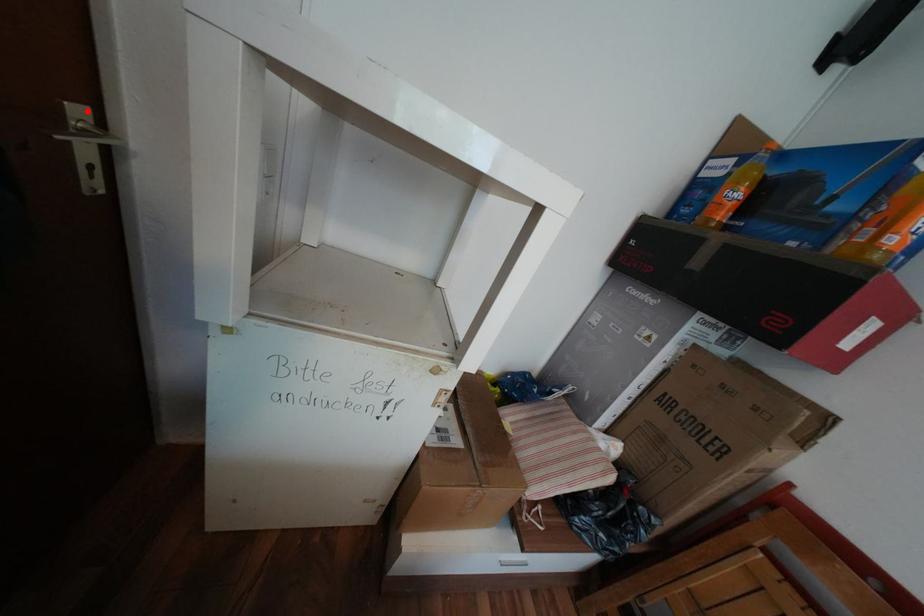
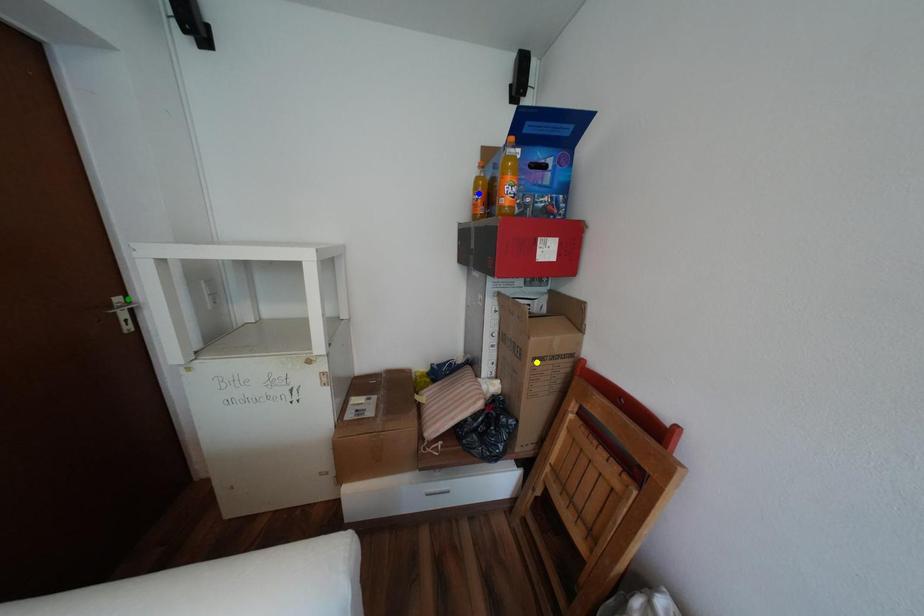
Question: I am providing you with two images of the same scene from different viewpoints. A red point is marked on the first image. You are given multiple points on the second image. Which mark in image 2 goes with the point in image 1?

Choices:
 (A) green point
 (B) yellow point
 (C) blue point

Answer: (A)